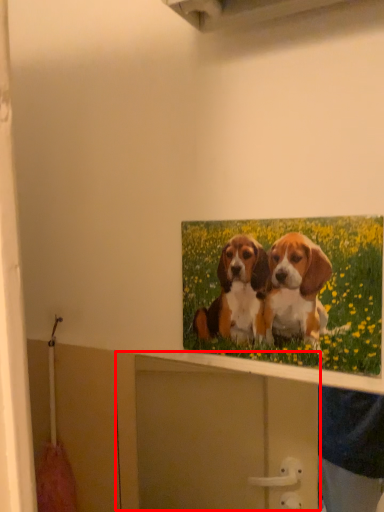
Question: In this image, where is cabinet (annotated by the red box) located relative to picture frame?

Choices:
 (A) right
 (B) left

Answer: (B)